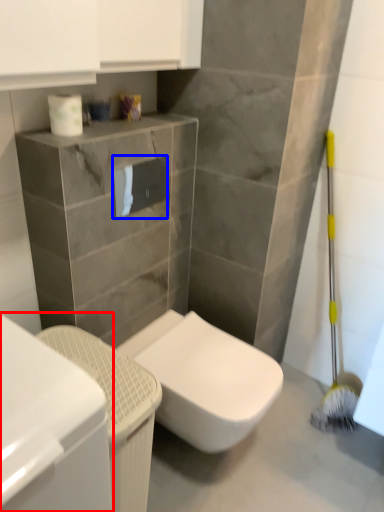
Question: Which object is further to the camera taking this photo, cabinetry (highlighted by a red box) or toilet paper (highlighted by a blue box)?

Choices:
 (A) cabinetry
 (B) toilet paper

Answer: (B)